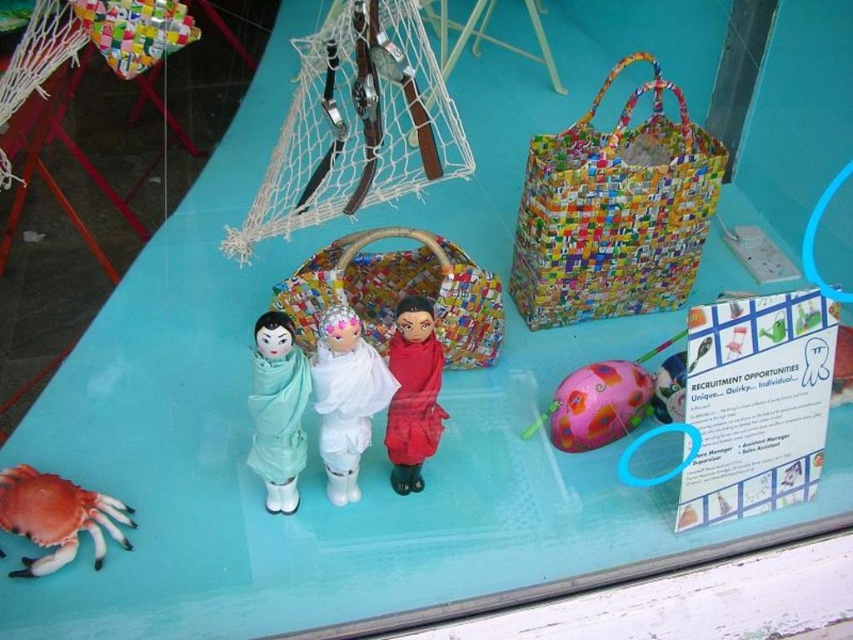
Is white glossy doll at center shorter than matte green fabric doll at center?

Indeed, white glossy doll at center has a lesser height compared to matte green fabric doll at center.

Consider the image. Which is above, white glossy doll at center or matte green fabric doll at center?

white glossy doll at center is above.

Between point (323, 429) and point (300, 408), which one is positioned behind?

Positioned behind is point (323, 429).

Locate an element on the screen. This screenshot has width=853, height=640. white glossy doll at center is located at coordinates (346, 397).

Which of these two, matte green fabric doll at center or red plastic crab at lower left, stands shorter?

red plastic crab at lower left

Find the location of `matte green fabric doll at center`. matte green fabric doll at center is located at coordinates (277, 410).

Find the location of a particular element. This screenshot has width=853, height=640. white glossy doll at center is located at coordinates (346, 397).

Is white glossy doll at center thinner than red plastic crab at lower left?

Correct, white glossy doll at center's width is less than red plastic crab at lower left's.

You are a GUI agent. You are given a task and a screenshot of the screen. Output one action in this format:
    pyautogui.click(x=<x>, y=<y>)
    Task: Click on the white glossy doll at center
    
    Given the screenshot: What is the action you would take?
    pyautogui.click(x=346, y=397)